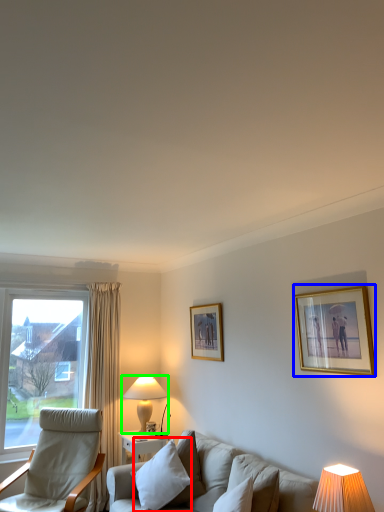
Question: Which is farther away from pillow (highlighted by a red box)? picture frame (highlighted by a blue box) or table lamp (highlighted by a green box)?

Choices:
 (A) picture frame
 (B) table lamp

Answer: (A)